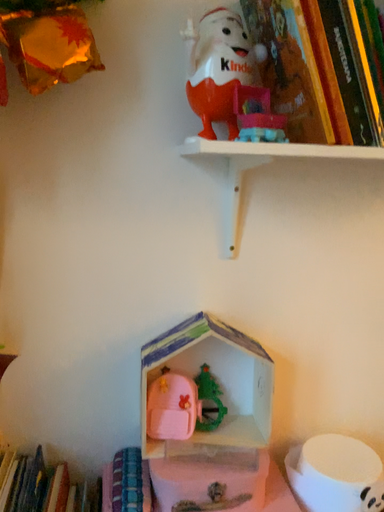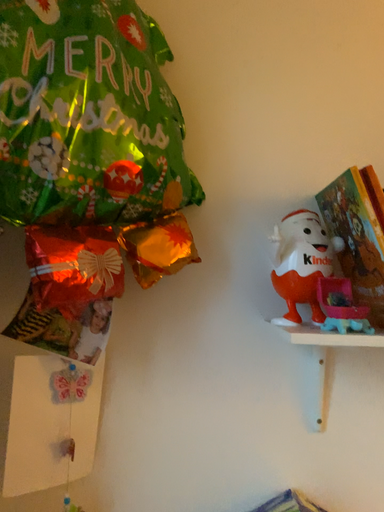
Question: How did the camera likely rotate when shooting the video?

Choices:
 (A) rotated right
 (B) rotated left

Answer: (B)